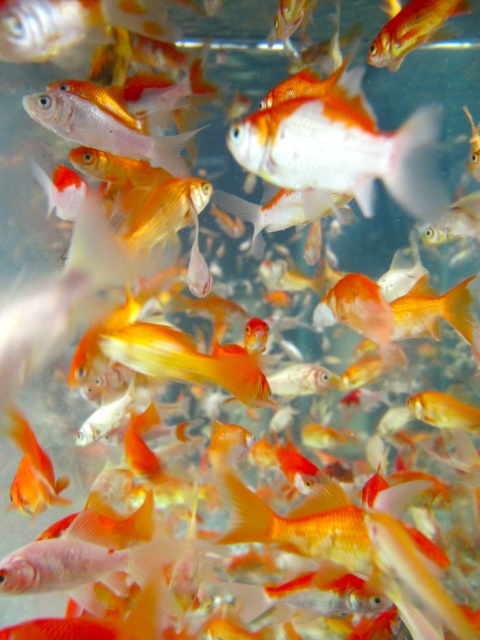
Question: Which point is farther from the camera taking this photo?

Choices:
 (A) (372, 124)
 (B) (436, 13)

Answer: (B)

Question: Can you confirm if shiny orange fish at center is positioned above shiny orange goldfish at upper right?

Choices:
 (A) yes
 (B) no

Answer: (B)

Question: Which point is farther from the camera taking this photo?

Choices:
 (A) (468, 10)
 (B) (408, 150)

Answer: (A)

Question: From the image, what is the correct spatial relationship of shiny orange fish at center in relation to shiny orange goldfish at upper right?

Choices:
 (A) below
 (B) above

Answer: (A)

Question: Does shiny orange fish at center have a smaller size compared to shiny orange goldfish at upper right?

Choices:
 (A) yes
 (B) no

Answer: (B)